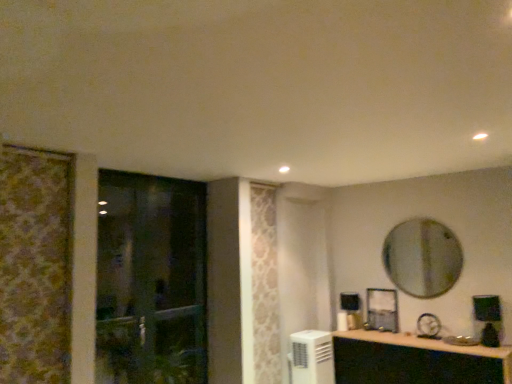
Question: Is matte black cabinet at lower right taller than white plastic air conditioner at lower center?

Choices:
 (A) no
 (B) yes

Answer: (B)

Question: Can you confirm if matte black cabinet at lower right is smaller than white plastic air conditioner at lower center?

Choices:
 (A) yes
 (B) no

Answer: (B)

Question: Considering the relative positions of matte black cabinet at lower right and white plastic air conditioner at lower center in the image provided, is matte black cabinet at lower right to the left of white plastic air conditioner at lower center from the viewer's perspective?

Choices:
 (A) no
 (B) yes

Answer: (A)

Question: Does matte black cabinet at lower right have a larger size compared to white plastic air conditioner at lower center?

Choices:
 (A) no
 (B) yes

Answer: (B)

Question: Considering the relative sizes of matte black cabinet at lower right and white plastic air conditioner at lower center in the image provided, is matte black cabinet at lower right wider than white plastic air conditioner at lower center?

Choices:
 (A) yes
 (B) no

Answer: (A)

Question: Considering the positions of matte black cabinet at lower right and silver metallic mirror at upper right in the image, is matte black cabinet at lower right taller or shorter than silver metallic mirror at upper right?

Choices:
 (A) short
 (B) tall

Answer: (A)

Question: Based on their sizes in the image, would you say matte black cabinet at lower right is bigger or smaller than silver metallic mirror at upper right?

Choices:
 (A) big
 (B) small

Answer: (A)

Question: Is matte black cabinet at lower right in front of or behind silver metallic mirror at upper right in the image?

Choices:
 (A) front
 (B) behind

Answer: (A)

Question: From a real-world perspective, relative to silver metallic mirror at upper right, is matte black cabinet at lower right vertically above or below?

Choices:
 (A) below
 (B) above

Answer: (A)

Question: Is point (141, 236) positioned closer to the camera than point (415, 347)?

Choices:
 (A) closer
 (B) farther

Answer: (A)

Question: From the image's perspective, is transparent glass door at left above or below matte black cabinet at lower right?

Choices:
 (A) above
 (B) below

Answer: (A)

Question: From a real-world perspective, is transparent glass door at left above or below matte black cabinet at lower right?

Choices:
 (A) below
 (B) above

Answer: (B)

Question: Looking at their shapes, would you say transparent glass door at left is wider or thinner than matte black cabinet at lower right?

Choices:
 (A) thin
 (B) wide

Answer: (A)

Question: Is white plastic air conditioner at lower center in front of or behind transparent glass door at left in the image?

Choices:
 (A) behind
 (B) front

Answer: (A)

Question: Does point (328, 342) appear closer or farther from the camera than point (197, 269)?

Choices:
 (A) farther
 (B) closer

Answer: (B)